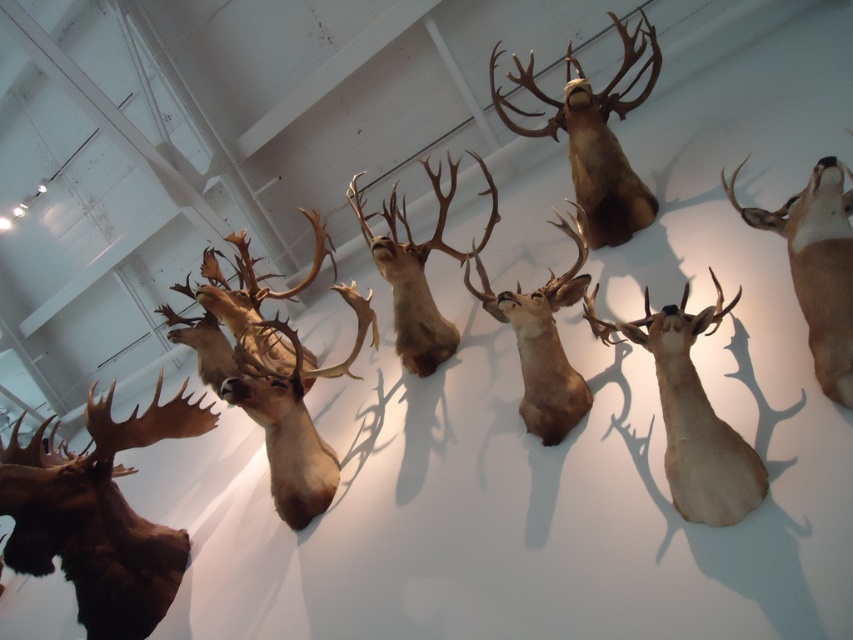
Question: Which object is closer to the camera taking this photo?

Choices:
 (A) shiny brown antlers at center
 (B) brown matte/deer head at upper right
 (C) brown matte/dead deer at lower left
 (D) light brown matte deer head at center

Answer: (B)

Question: Which of the following is the closest to the observer?

Choices:
 (A) brown matte/deer head at upper right
 (B) brown matte/dead deer at upper center

Answer: (A)

Question: Estimate the real-world distances between objects in this image. Which object is farther from the brown matte/dead deer at upper center?

Choices:
 (A) shiny brown antlers at center
 (B) brown matte/dead deer at lower left
 (C) light brown matte deer head at center

Answer: (B)

Question: Can you confirm if matte brown deer head at center is positioned to the left of brown matte/deer head at center?

Choices:
 (A) no
 (B) yes

Answer: (B)

Question: Can you confirm if shiny brown antlers at center is positioned to the left of brown matte/deer head at upper right?

Choices:
 (A) yes
 (B) no

Answer: (A)

Question: Is brown matte/dead deer at lower left to the right of shiny brown antlers at center from the viewer's perspective?

Choices:
 (A) yes
 (B) no

Answer: (B)